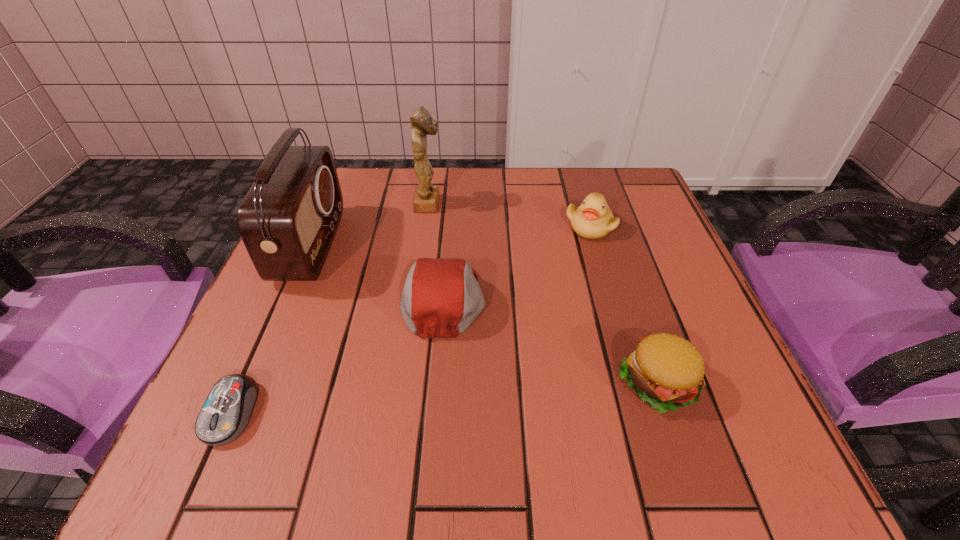
The image size is (960, 540). I want to click on figurine, so click(426, 199).

Identify the location of radio receiver. Image resolution: width=960 pixels, height=540 pixels. (288, 219).

At what (x,y) coordinates should I click in order to perform the action: click on cap. Please return your answer as a coordinate pair (x, y). The width and height of the screenshot is (960, 540). Looking at the image, I should click on (441, 298).

In order to click on duckling in this screenshot , I will do `click(593, 219)`.

Where is `hamburger`? This screenshot has height=540, width=960. hamburger is located at coordinates (666, 371).

Locate an element on the screen. computer mouse is located at coordinates (226, 412).

Where is `vacant area situated 0.310m on the front-facing side of the figurine`? The image size is (960, 540). vacant area situated 0.310m on the front-facing side of the figurine is located at coordinates (574, 204).

This screenshot has height=540, width=960. In order to click on free space located on the front panel of the radio receiver in this screenshot , I will do `click(390, 246)`.

Where is `vacant space located on the front-facing side of the cap`? vacant space located on the front-facing side of the cap is located at coordinates (555, 299).

The width and height of the screenshot is (960, 540). I want to click on free space located 0.260m on the beak of the duckling, so click(623, 340).